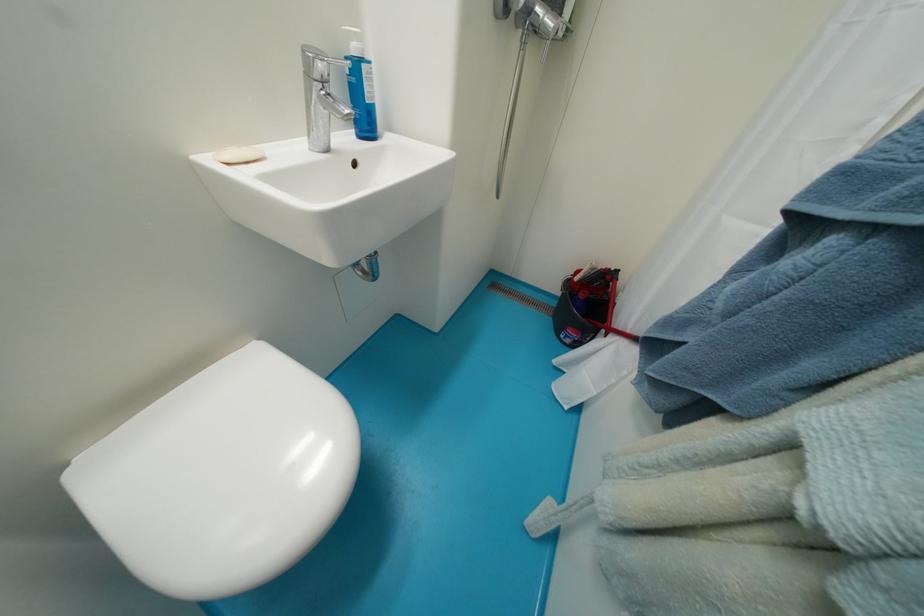
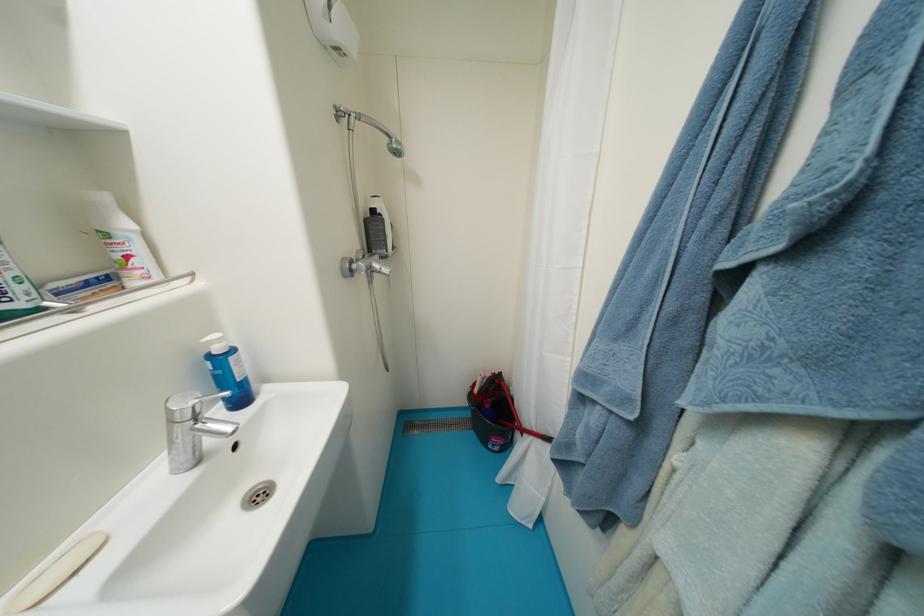
Question: The first image is from the beginning of the video and the second image is from the end. How did the camera likely rotate when shooting the video?

Choices:
 (A) Left
 (B) Right
 (C) Up
 (D) Down

Answer: (B)